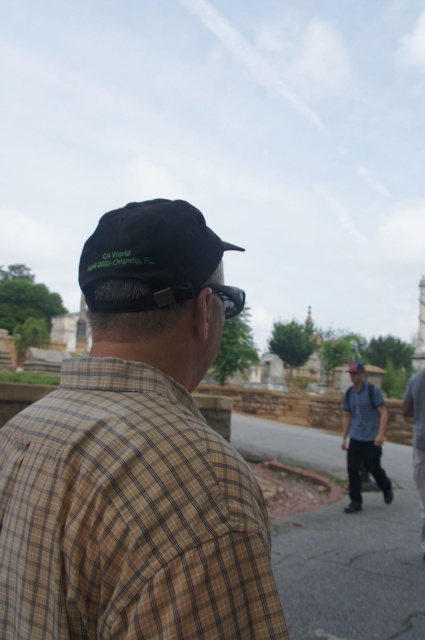
You are standing at the point marked as point (150, 256) in the image. What object is directly in front of you?

The black fabric baseball cap at upper left is directly in front of you at point (150, 256).

You are standing at the point labeled point (150, 396) and want to walk to the point labeled point (359, 474). Given that both points are in the cemetery scene described, which direction should you move to get closer to your destination?

To move from point (150, 396) to point (359, 474), you should move downward and to the right since point (359, 474) is farther away from the camera compared to your current position at point (150, 396).